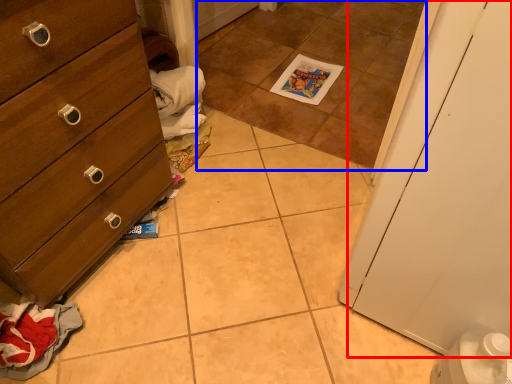
Question: Which of the following is the closest to the observer, door (highlighted by a red box) or tile (highlighted by a blue box)?

Choices:
 (A) door
 (B) tile

Answer: (A)